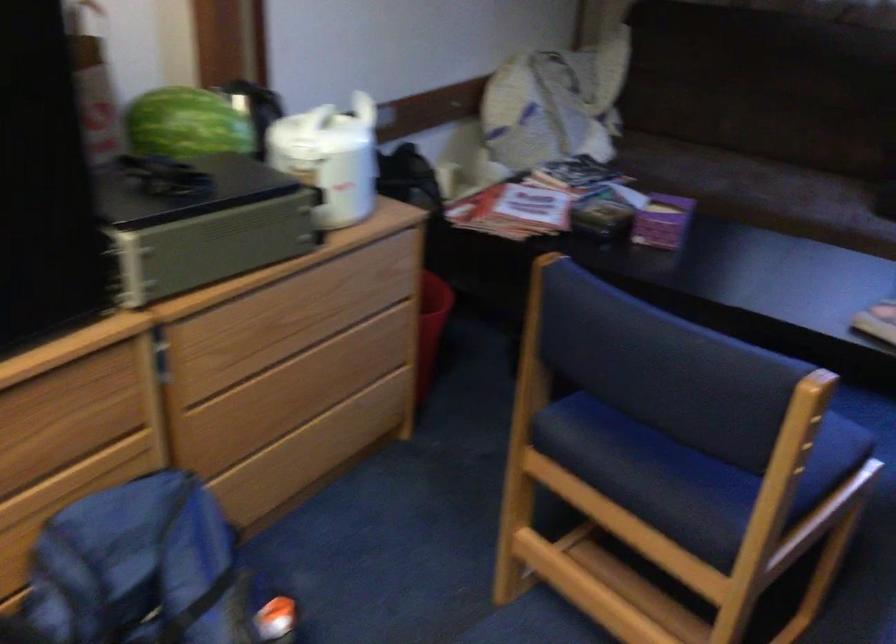
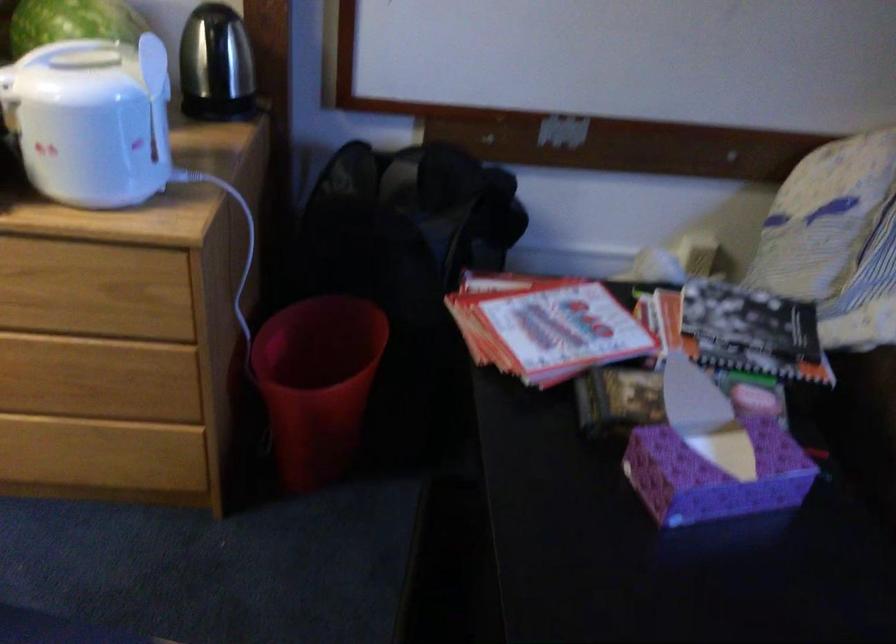
The point at (354, 134) is marked in the first image. Where is the corresponding point in the second image?

(156, 97)